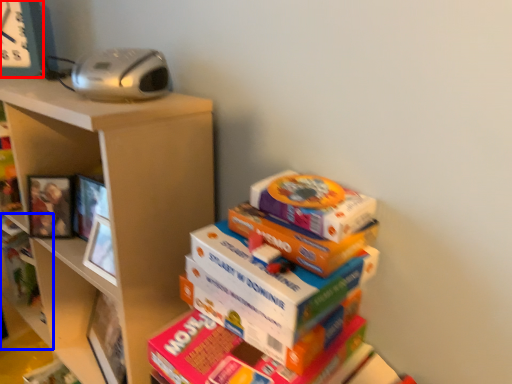
Question: Which object is further to the camera taking this photo, clock (highlighted by a red box) or shelf (highlighted by a blue box)?

Choices:
 (A) clock
 (B) shelf

Answer: (B)